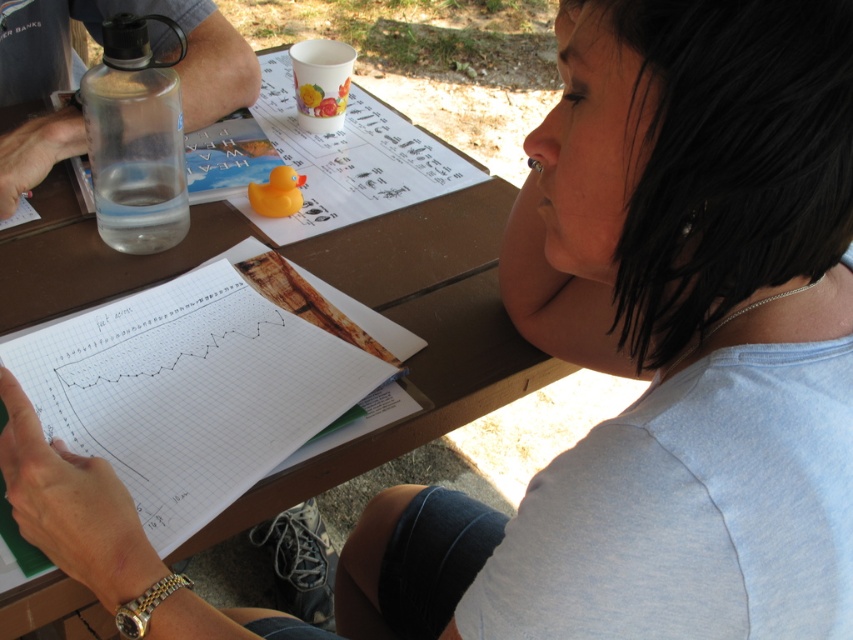
You are standing at the picnic table and want to place a new item exactly at the point marked as point (415, 332). Can you confirm if this point is located on the picnic table?

Yes, the point (415, 332) is on the brown wooden picnic table at center, so placing the item there would be appropriate.

You are standing in front of the picnic table and want to place a small item on the table. You have two points marked on the table surface at coordinates point (125, 324) and point (30, 179). Which point is closer to you if you are facing the table directly?

Point (125, 324) is closer to the viewer than point (30, 179).